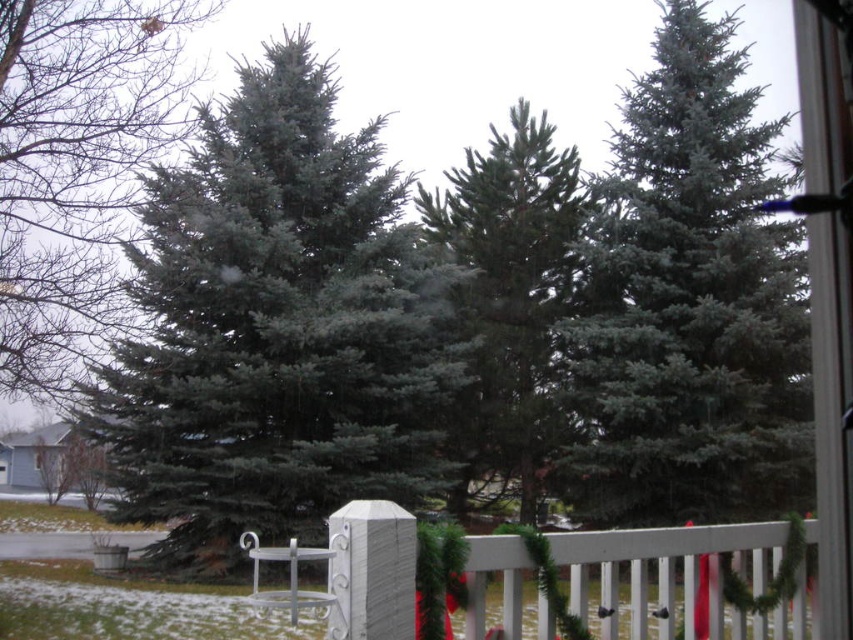
Question: Which is farther from the green matte evergreen tree at left?

Choices:
 (A) green matte fir tree at upper center
 (B) white wooden fence at lower center
 (C) green matte fir tree at left

Answer: (A)

Question: Which of these objects is positioned farthest from the green matte tree at center?

Choices:
 (A) green matte evergreen tree at left
 (B) green matte fir tree at left
 (C) green matte fir tree at upper center
 (D) white wooden fence at lower center

Answer: (D)

Question: Can you confirm if green matte evergreen tree at left is thinner than green matte tree at center?

Choices:
 (A) yes
 (B) no

Answer: (B)

Question: Which of the following is the closest to the observer?

Choices:
 (A) green matte fir tree at left
 (B) green matte tree at center

Answer: (A)

Question: In this image, where is green matte evergreen tree at left located relative to green matte tree at center?

Choices:
 (A) right
 (B) left

Answer: (B)

Question: Can you confirm if green matte evergreen tree at left is bigger than green matte tree at center?

Choices:
 (A) no
 (B) yes

Answer: (B)